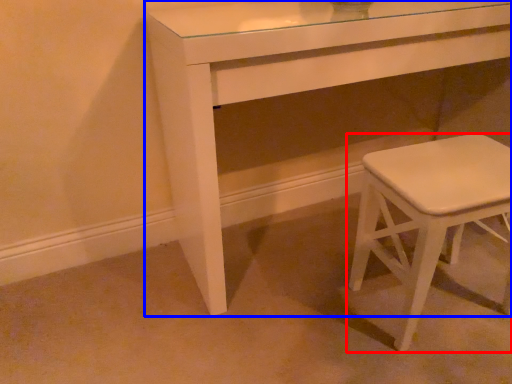
Question: Among these objects, which one is farthest to the camera, stool (highlighted by a red box) or table (highlighted by a blue box)?

Choices:
 (A) stool
 (B) table

Answer: (A)